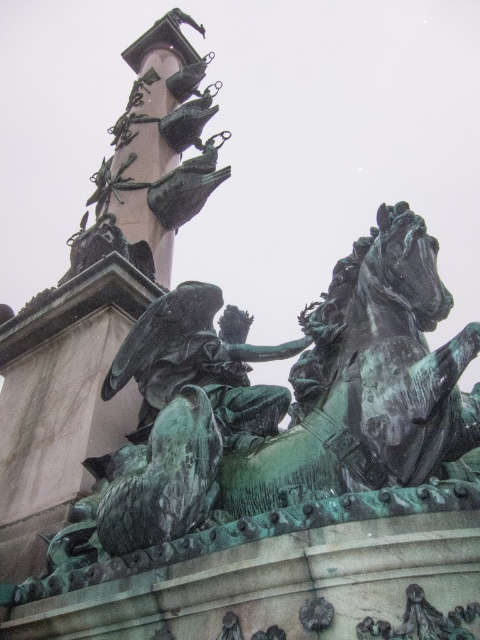
Question: Among these objects, which one is nearest to the camera?

Choices:
 (A) green patina horse at center
 (B) green patina statue at center

Answer: (A)

Question: Which object is closer to the camera taking this photo?

Choices:
 (A) green patina statue at center
 (B) green patina horse at center

Answer: (B)

Question: Is green patina horse at center wider than green patina statue at center?

Choices:
 (A) no
 (B) yes

Answer: (B)

Question: Is green patina horse at center further to camera compared to green patina statue at center?

Choices:
 (A) yes
 (B) no

Answer: (B)

Question: Does green patina horse at center appear on the left side of green patina statue at center?

Choices:
 (A) no
 (B) yes

Answer: (A)